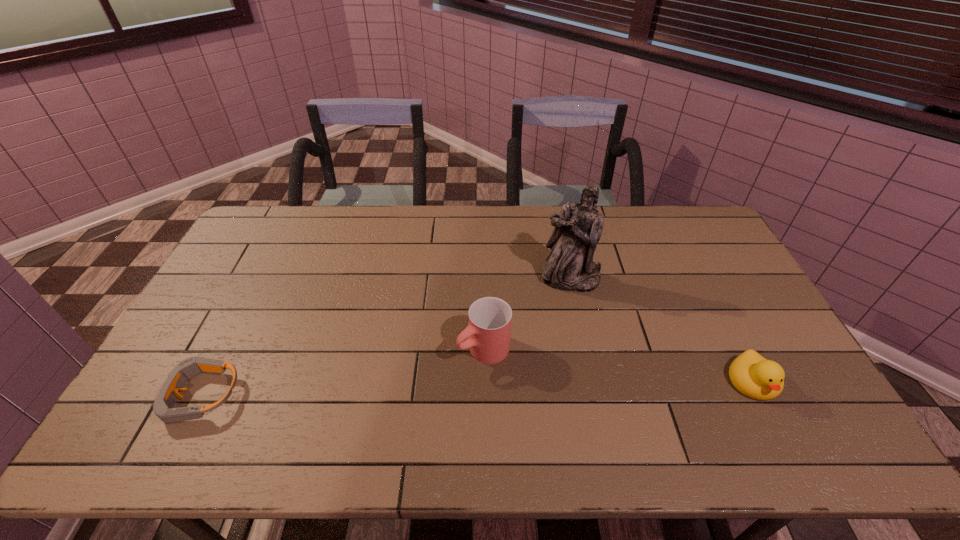
Image resolution: width=960 pixels, height=540 pixels. I want to click on vacant area located on the front-facing side of the figurine, so click(x=556, y=356).

Identify the location of vacant area situated on the side of the second object from left to right with the handle. The image size is (960, 540). [433, 381].

Locate an element on the screen. blank space located on the side of the second object from left to right with the handle is located at coordinates (386, 411).

Image resolution: width=960 pixels, height=540 pixels. In order to click on goggles at the near edge in this screenshot , I will do `click(187, 369)`.

Where is `duckling that is at the near edge`? Image resolution: width=960 pixels, height=540 pixels. duckling that is at the near edge is located at coordinates (754, 376).

This screenshot has height=540, width=960. What are the coordinates of `object present at the left edge` in the screenshot? It's located at (187, 369).

At what (x,y) coordinates should I click in order to perform the action: click on object present at the right edge. Please return your answer as a coordinate pair (x, y). This screenshot has width=960, height=540. Looking at the image, I should click on (754, 376).

Image resolution: width=960 pixels, height=540 pixels. In order to click on object at the near left corner in this screenshot , I will do `click(187, 369)`.

At what (x,y) coordinates should I click in order to perform the action: click on object present at the near right corner. Please return your answer as a coordinate pair (x, y). The width and height of the screenshot is (960, 540). Looking at the image, I should click on (754, 376).

Locate an element on the screen. free location at the far edge is located at coordinates (442, 230).